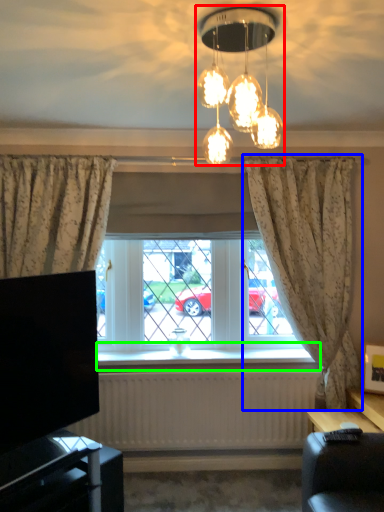
Question: Which object is the farthest from lamp (highlighted by a red box)? Choose among these: curtain (highlighted by a blue box) or window sill (highlighted by a green box).

Choices:
 (A) curtain
 (B) window sill

Answer: (B)